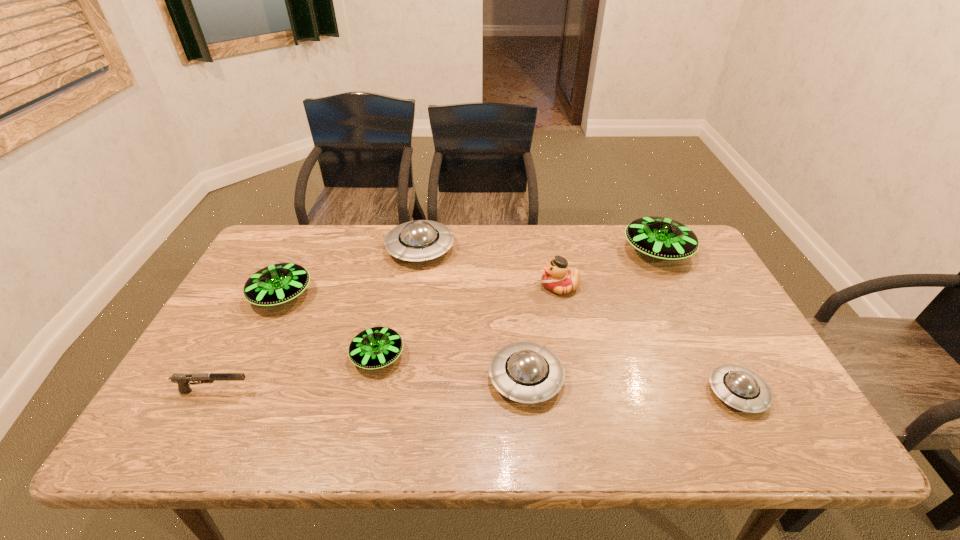
Locate an element on the screen. empty space between the second green saucer from left to right and the leftmost gray saucer is located at coordinates (399, 302).

This screenshot has width=960, height=540. Identify the location of the seventh closest object relative to the third farthest saucer. (741, 388).

The height and width of the screenshot is (540, 960). Identify the location of object that is the seventh nearest to the leftmost green saucer. (741, 388).

Find the location of `saucer that is the fifth closest to the biggest green saucer`. saucer that is the fifth closest to the biggest green saucer is located at coordinates (276, 284).

Select which saucer is the fifth closest to the rightmost green saucer. Please provide its 2D coordinates. Your answer should be formatted as a tuple, i.e. [(x, y)], where the tuple contains the x and y coordinates of a point satisfying the conditions above.

[(276, 284)]

Identify the location of green saucer that is the closest to the second smallest green saucer. (377, 347).

Select which green saucer is the second closest to the second green saucer from right to left. Please provide its 2D coordinates. Your answer should be formatted as a tuple, i.e. [(x, y)], where the tuple contains the x and y coordinates of a point satisfying the conditions above.

[(661, 238)]

Locate an element on the screen. gray saucer that can be found as the closest to the rightmost green saucer is located at coordinates (741, 388).

Where is `gray saucer identified as the closest to the third saucer from right to left`? gray saucer identified as the closest to the third saucer from right to left is located at coordinates (419, 240).

Identify the location of vacant space that satisfies the following two spatial constraints: 1. at the muzzle end of the gun; 2. on the right side of the rightmost gray saucer. The width and height of the screenshot is (960, 540). (214, 393).